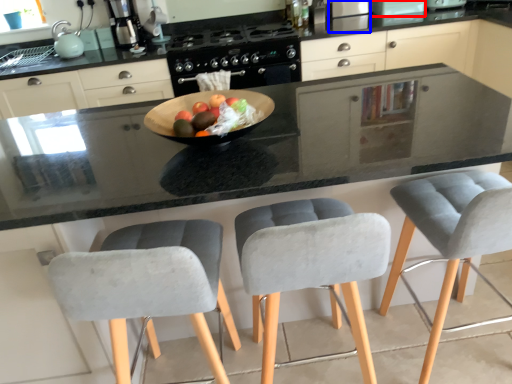
Question: Which object appears farthest to the camera in this image, appliance (highlighted by a red box) or appliance (highlighted by a blue box)?

Choices:
 (A) appliance
 (B) appliance

Answer: (B)